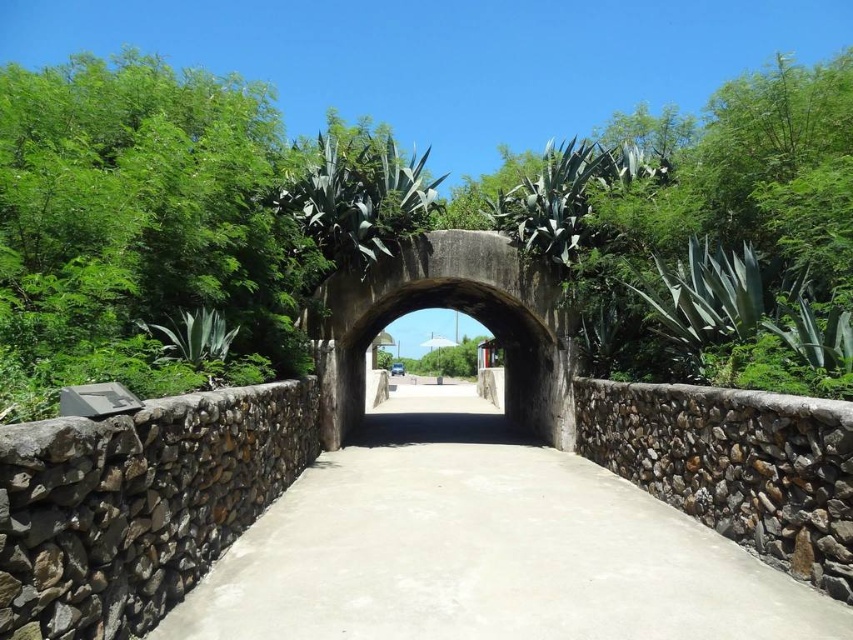
Can you confirm if green leafy tree at center is positioned above smooth concrete path at center?

Yes, green leafy tree at center is above smooth concrete path at center.

Locate an element on the screen. The width and height of the screenshot is (853, 640). green leafy tree at center is located at coordinates (415, 228).